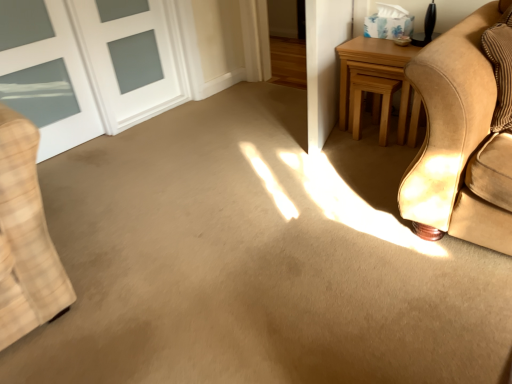
I want to click on white glass door at upper left, so click(x=89, y=66).

What do you see at coordinates (373, 81) in the screenshot?
I see `light brown wooden table at right` at bounding box center [373, 81].

Find the location of a particular element. This screenshot has width=512, height=384. light brown wood stool at upper right is located at coordinates (374, 95).

From the image's perspective, is light brown wooden table at right on white glass door at upper left?

Actually, light brown wooden table at right appears below white glass door at upper left in the image.

Does point (362, 45) lie behind point (134, 124)?

No, it is in front of (134, 124).

Is light brown wooden table at right in front of or behind white glass door at upper left in the image?

Visually, light brown wooden table at right is located behind white glass door at upper left.

Does light brown wooden table at right appear on the left side of white glass door at upper left?

No, light brown wooden table at right is not to the left of white glass door at upper left.

Considering the sizes of objects light brown wood stool at upper right and light brown wooden table at right in the image provided, who is taller, light brown wood stool at upper right or light brown wooden table at right?

With more height is light brown wooden table at right.

Considering the sizes of light brown wood stool at upper right and light brown wooden table at right in the image, is light brown wood stool at upper right bigger or smaller than light brown wooden table at right?

Considering their sizes, light brown wood stool at upper right takes up less space than light brown wooden table at right.

Is light brown wood stool at upper right to the right of light brown wooden table at right from the viewer's perspective?

Incorrect, light brown wood stool at upper right is not on the right side of light brown wooden table at right.

Find the location of a particular element. table above the light brown wood stool at upper right (from a real-world perspective) is located at coordinates pos(373,81).

In the image, is white glass door at upper left on the left side or the right side of light brown wooden table at right?

In the image, white glass door at upper left appears on the left side of light brown wooden table at right.

How different are the orientations of white glass door at upper left and light brown wooden table at right in degrees?

There is a 89.5-degree angle between the facing directions of white glass door at upper left and light brown wooden table at right.

Is point (24, 83) in front of point (380, 124)?

That is False.

This screenshot has height=384, width=512. I want to click on door above the light brown wooden table at right (from the image's perspective), so click(89, 66).

Considering the sizes of objects light brown wooden table at right and light brown wood stool at upper right in the image provided, who is taller, light brown wooden table at right or light brown wood stool at upper right?

With more height is light brown wooden table at right.

Is light brown wooden table at right in front of or behind light brown wood stool at upper right in the image?

light brown wooden table at right is positioned closer to the viewer than light brown wood stool at upper right.

Which of these two, light brown wooden table at right or light brown wood stool at upper right, is bigger?

With larger size is light brown wooden table at right.

From a real-world perspective, who is located lower, light brown wooden table at right or light brown wood stool at upper right?

light brown wood stool at upper right is physically lower.

Is light brown wood stool at upper right at the right side of white glass door at upper left?

Correct, you'll find light brown wood stool at upper right to the right of white glass door at upper left.

Consider the image. Is there a large distance between light brown wood stool at upper right and white glass door at upper left?

Indeed, light brown wood stool at upper right is not near white glass door at upper left.

Where is `stool below the white glass door at upper left (from the image's perspective)`? The height and width of the screenshot is (384, 512). stool below the white glass door at upper left (from the image's perspective) is located at coordinates (374, 95).

In the scene shown: From a real-world perspective, is light brown wood stool at upper right positioned under white glass door at upper left based on gravity?

Correct, in the physical world, light brown wood stool at upper right is lower than white glass door at upper left.

Considering the positions of objects white glass door at upper left and light brown wood stool at upper right in the image provided, who is more to the right, white glass door at upper left or light brown wood stool at upper right?

light brown wood stool at upper right is more to the right.

Is white glass door at upper left beside light brown wood stool at upper right?

No, white glass door at upper left is not next to light brown wood stool at upper right.

Which is closer, (106,96) or (356,76)?

Point (106,96) is farther from the camera than point (356,76).

Where is `door in front of the light brown wooden table at right`? door in front of the light brown wooden table at right is located at coordinates (89, 66).

The image size is (512, 384). Identify the location of stool behind the light brown wooden table at right. (374, 95).

Looking at the image, which one is located closer to light brown wood stool at upper right, white glass door at upper left or light brown wooden table at right?

Among the two, light brown wooden table at right is located nearer to light brown wood stool at upper right.

From the image, which object appears to be nearer to white glass door at upper left, light brown wooden table at right or light brown wood stool at upper right?

light brown wooden table at right is closer to white glass door at upper left.

Looking at the image, which one is located further to white glass door at upper left, light brown wood stool at upper right or light brown wooden table at right?

light brown wood stool at upper right is positioned further to the anchor white glass door at upper left.

Looking at the image, which one is located closer to light brown wooden table at right, light brown wood stool at upper right or white glass door at upper left?

Among the two, light brown wood stool at upper right is located nearer to light brown wooden table at right.

Looking at the image, which one is located further to light brown wooden table at right, white glass door at upper left or light brown wood stool at upper right?

white glass door at upper left is further to light brown wooden table at right.

Considering their positions, is light brown wooden table at right positioned closer to light brown wood stool at upper right than white glass door at upper left?

light brown wooden table at right lies closer to light brown wood stool at upper right than the other object.

At what (x,y) coordinates should I click in order to perform the action: click on stool situated between white glass door at upper left and light brown wooden table at right from left to right. Please return your answer as a coordinate pair (x, y). The image size is (512, 384). Looking at the image, I should click on (374, 95).